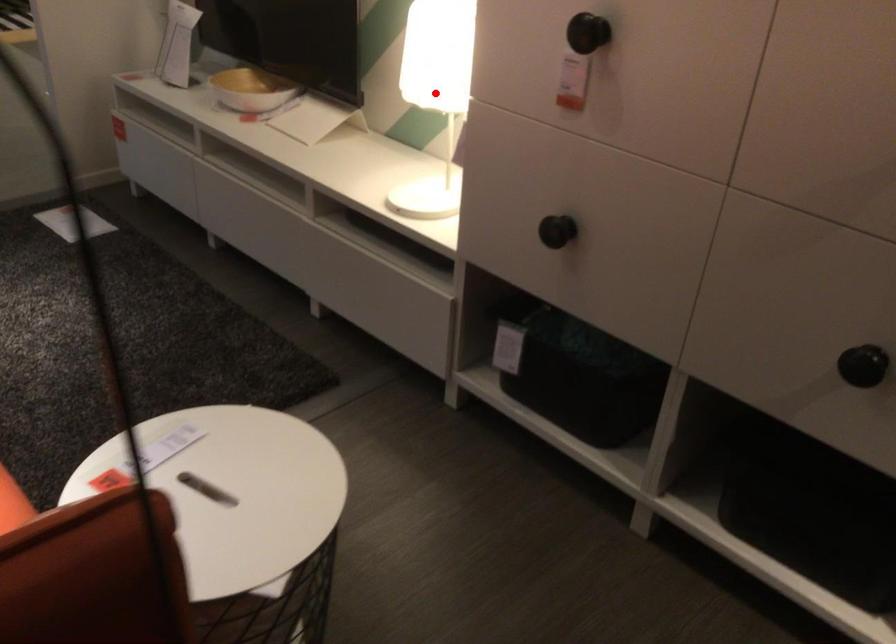
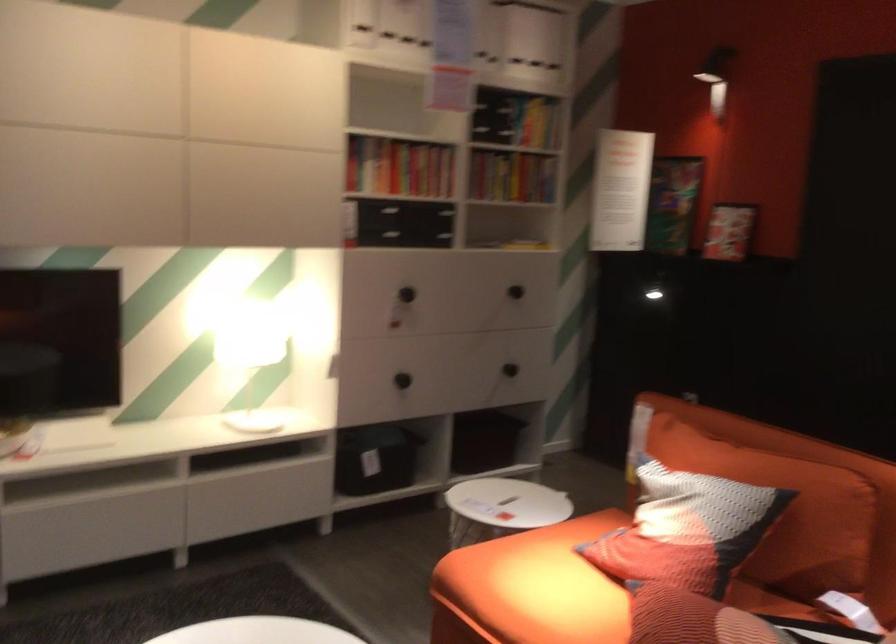
In the second image, find the point that corresponds to the highlighted location in the first image.

(289, 350)